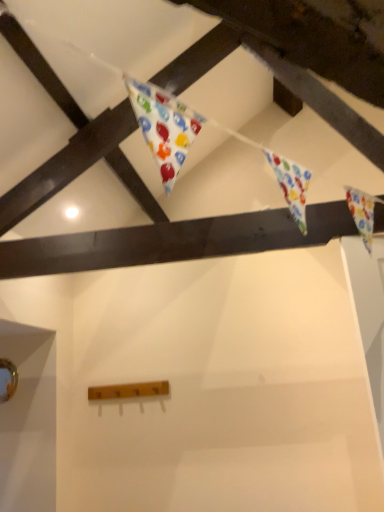
I want to click on white glossy light at upper center, so click(x=71, y=212).

The height and width of the screenshot is (512, 384). What do you see at coordinates (71, 212) in the screenshot? I see `white glossy light at upper center` at bounding box center [71, 212].

At what (x,y) coordinates should I click in order to perform the action: click on white glossy light at upper center. Please return your answer as a coordinate pair (x, y). Looking at the image, I should click on (71, 212).